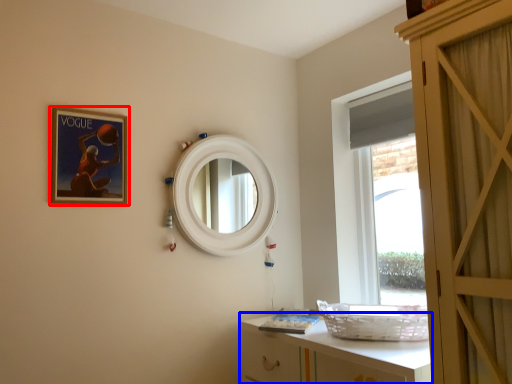
Question: Among these objects, which one is farthest to the camera, picture frame (highlighted by a red box) or cabinetry (highlighted by a blue box)?

Choices:
 (A) picture frame
 (B) cabinetry

Answer: (A)